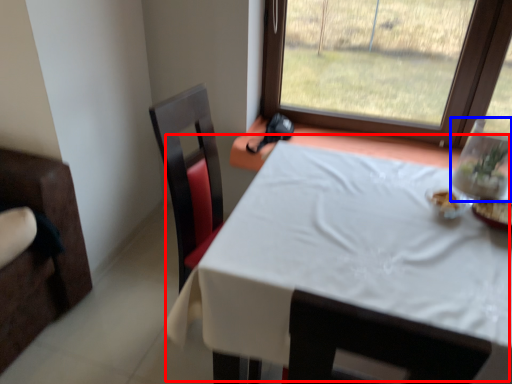
Question: Which point is closer to the camera, table (highlighted by a red box) or glass vase (highlighted by a blue box)?

Choices:
 (A) table
 (B) glass vase

Answer: (A)